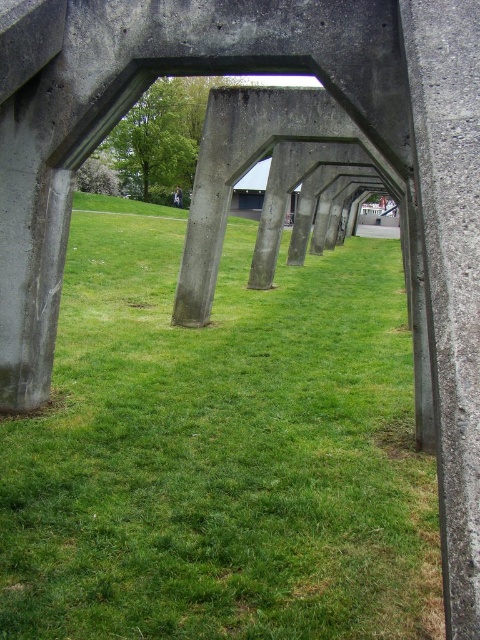
You are standing at the entrance of the arches and want to place a small flag at the point marked as point (219, 451). According to the image, will the flag be placed on the green grassy area at center?

Yes, the point (219, 451) is on the green grassy area at center, so placing the flag there will be on the green grassy area at center.